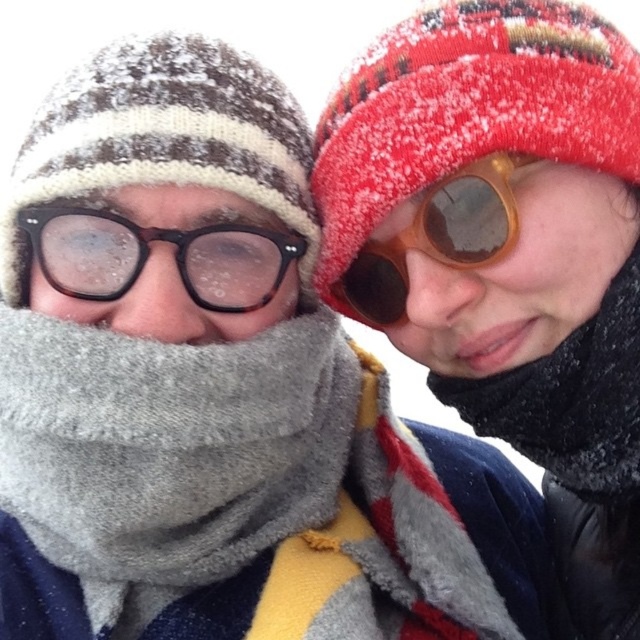
Can you confirm if tortoiseshell plastic glasses at left is thinner than brown wooden sunglasses at upper right?

No.

Does tortoiseshell plastic glasses at left have a greater height compared to brown wooden sunglasses at upper right?

Incorrect, tortoiseshell plastic glasses at left's height is not larger of brown wooden sunglasses at upper right's.

Is point (240, 259) positioned before point (392, 323)?

Yes, it is in front of point (392, 323).

This screenshot has width=640, height=640. In order to click on tortoiseshell plastic glasses at left in this screenshot , I will do `click(148, 253)`.

Identify the location of gray fleece scarf at center. The image size is (640, 640). pos(230,488).

Who is more distant from viewer, (52, 476) or (429, 216)?

The point (429, 216) is more distant.

You are a GUI agent. You are given a task and a screenshot of the screen. Output one action in this format:
    pyautogui.click(x=<x>, y=<y>)
    Task: Click on the gray fleece scarf at center
    The width and height of the screenshot is (640, 640).
    Given the screenshot: What is the action you would take?
    pyautogui.click(x=230, y=488)

How much distance is there between gray fleece scarf at center and tortoiseshell plastic glasses at left?

The distance of gray fleece scarf at center from tortoiseshell plastic glasses at left is 7.54 inches.

The image size is (640, 640). In order to click on gray fleece scarf at center in this screenshot , I will do `click(230, 488)`.